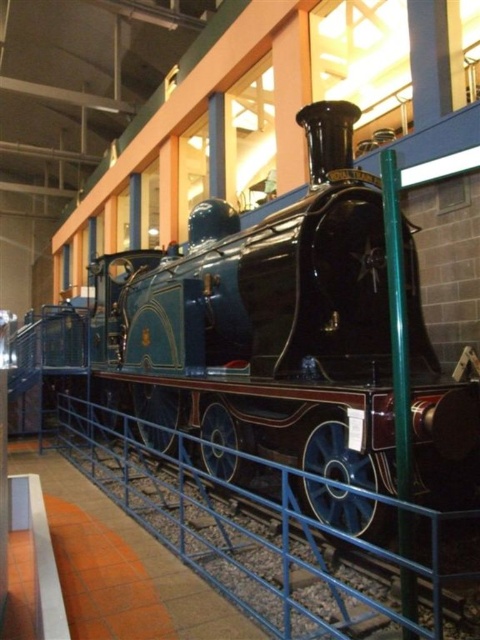
Question: Is glossy black train at center smaller than blue metal rail at lower center?

Choices:
 (A) no
 (B) yes

Answer: (A)

Question: Which of the following is the closest to the observer?

Choices:
 (A) blue metal rail at lower center
 (B) glossy black train at center

Answer: (A)

Question: Is glossy black train at center thinner than blue metal rail at lower center?

Choices:
 (A) yes
 (B) no

Answer: (A)

Question: Which of the following is the closest to the observer?

Choices:
 (A) blue metal rail at lower center
 (B) glossy black train at center

Answer: (A)

Question: Does glossy black train at center appear on the right side of blue metal rail at lower center?

Choices:
 (A) no
 (B) yes

Answer: (B)